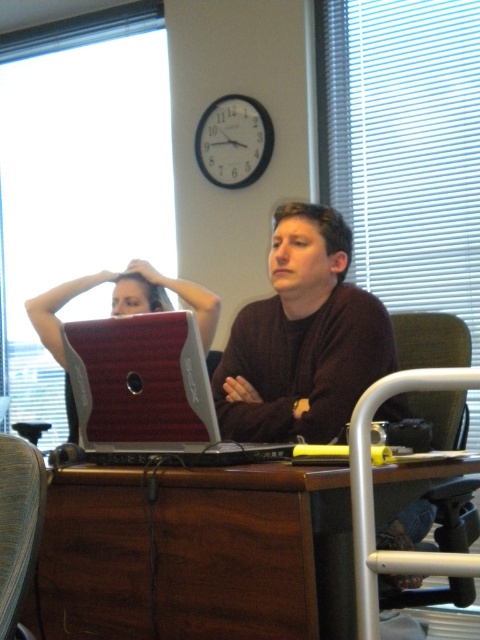
Can you confirm if brown matte sweater at center is smaller than matte brown hair at center?

No.

Is point (236, 355) behind point (290, 212)?

Yes.

Who is more distant from viewer, (291, 301) or (283, 252)?

The point (291, 301) is more distant.

Identify the location of brown matte sweater at center. This screenshot has height=640, width=480. (302, 339).

Based on the photo, does brown matte sweater at center have a smaller size compared to textured fabric swivel chair at lower left?

→ Actually, brown matte sweater at center might be larger than textured fabric swivel chair at lower left.

Can you confirm if brown matte sweater at center is wider than textured fabric swivel chair at lower left?

Yes.

In the scene shown: Who is more forward, [268,433] or [1,534]?

Positioned in front is point [1,534].

This screenshot has width=480, height=640. Find the location of `brown matte sweater at center`. brown matte sweater at center is located at coordinates (302, 339).

Does point (152, 276) come farther from viewer compared to point (131, 276)?

That is True.

Is metallic silver laptop at center below dark brown hair at upper center?

Indeed, metallic silver laptop at center is positioned under dark brown hair at upper center.

Does point (153, 307) come farther from viewer compared to point (146, 282)?

Yes.

You are a GUI agent. You are given a task and a screenshot of the screen. Output one action in this format:
    pyautogui.click(x=<x>, y=<y>)
    Task: Click on the metallic silver laptop at center
    The width and height of the screenshot is (480, 640).
    Given the screenshot: What is the action you would take?
    pyautogui.click(x=120, y=308)